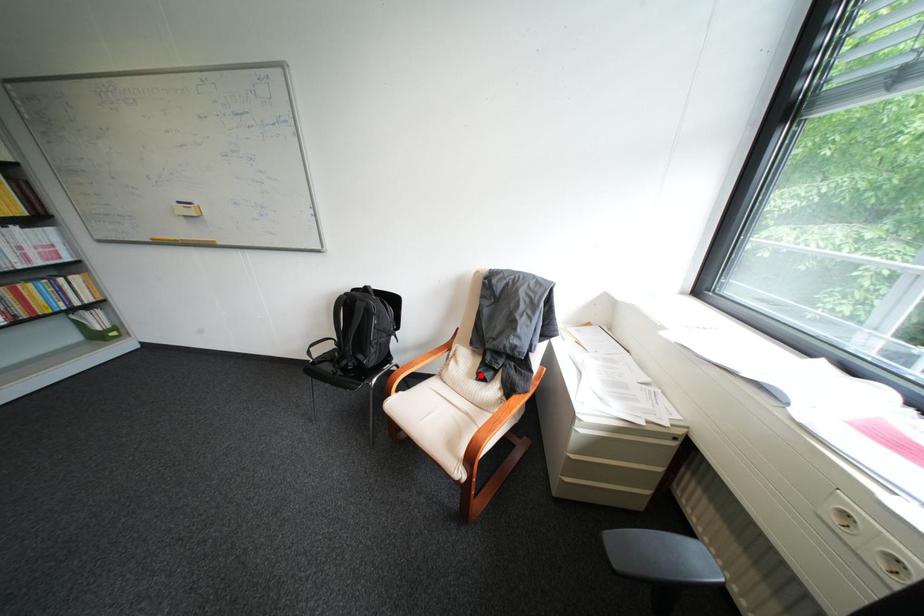
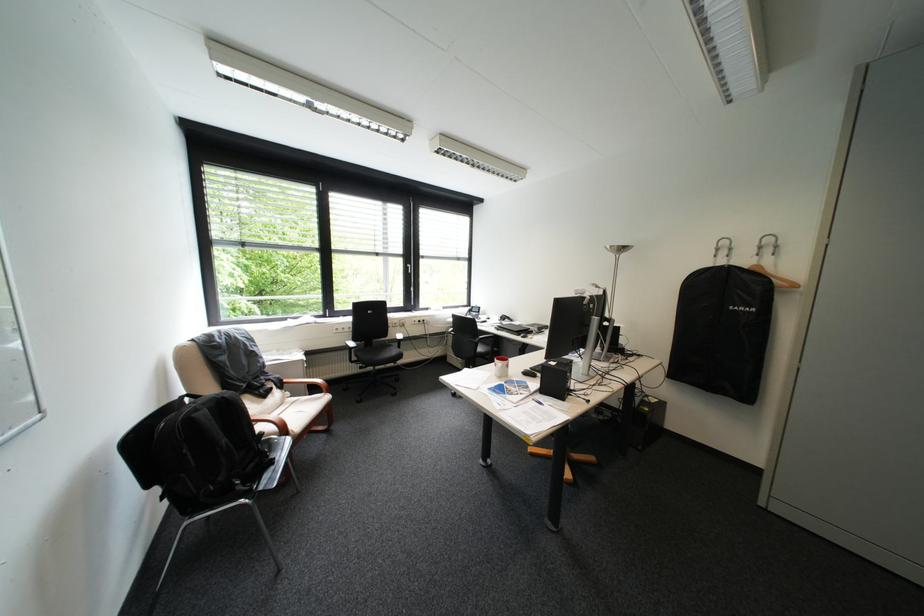
Where in the second image is the point corresponding to the highlighted location from the first image?

(272, 403)